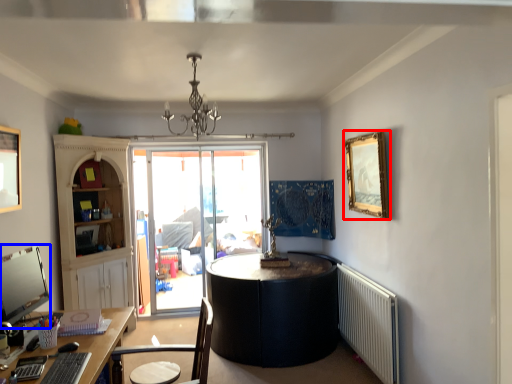
Question: Which of the following is the farthest to the observer, picture frame (highlighted by a red box) or computer monitor (highlighted by a blue box)?

Choices:
 (A) picture frame
 (B) computer monitor

Answer: (A)